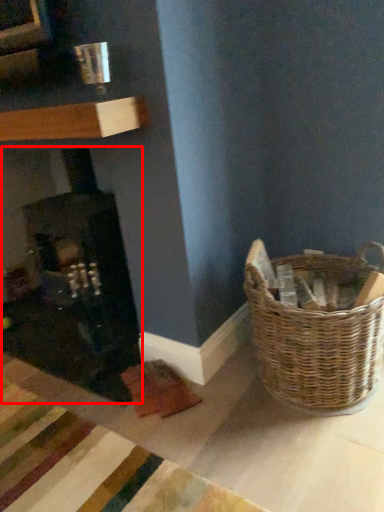
Question: Observing the image, what is the correct spatial positioning of fireplace (annotated by the red box) in reference to picnic basket?

Choices:
 (A) right
 (B) left

Answer: (B)